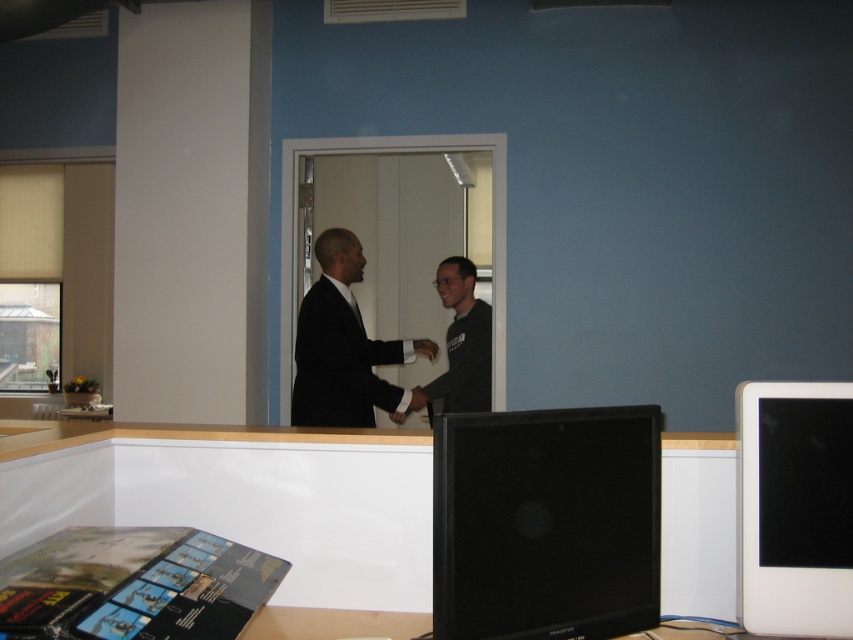
You are organizing items on a desk in an office. You have a dark gray sweater at center and a black matte hand at center. Which item is wider?

The dark gray sweater at center is wider than the black matte hand at center.

You are organizing items on a desk in an office with a white column and a window with blinds on the left. You have a dark gray sweater at center. Where exactly is the dark gray sweater positioned relative to the desk?

The dark gray sweater at center is located at point coordinates approximately 0.536 on the x axis and 0.543 on the y axis relative to the desk.